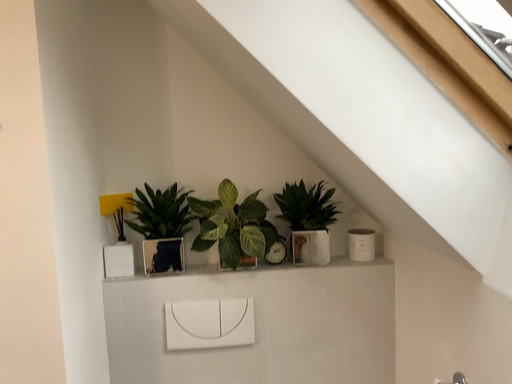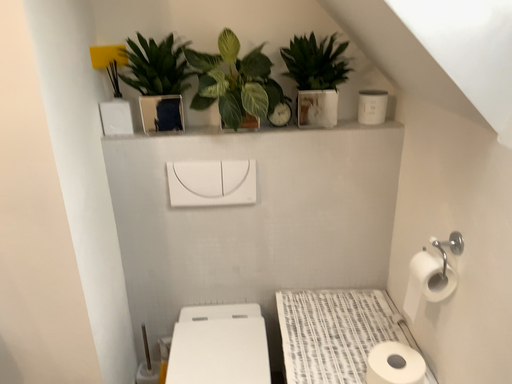
Question: Which way did the camera rotate in the video?

Choices:
 (A) rotated upward
 (B) rotated downward

Answer: (B)